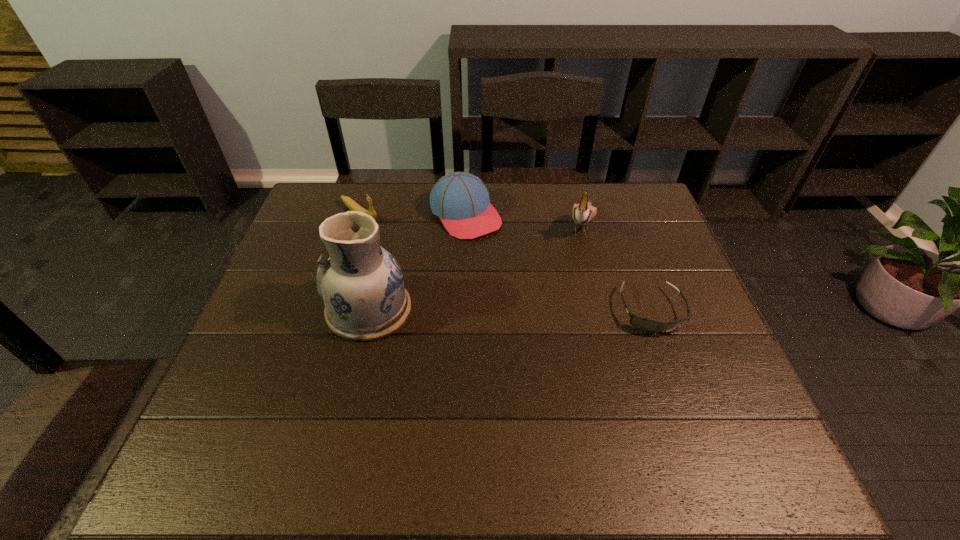
Find the location of a particular element. The image size is (960, 540). vacant space on the desktop that is between the tallest object and the goggles and is positioned at the face of the bird is located at coordinates (551, 310).

At what (x,y) coordinates should I click in order to perform the action: click on vacant space on the desktop that is between the tallest object and the shortest object and is positioned at the stem of the banana. Please return your answer as a coordinate pair (x, y). The image size is (960, 540). Looking at the image, I should click on (494, 310).

Find the location of a particular element. This screenshot has height=540, width=960. vacant space on the desktop that is between the tallest object and the shortest object and is positioned on the front-facing side of the third object from right to left is located at coordinates click(x=550, y=310).